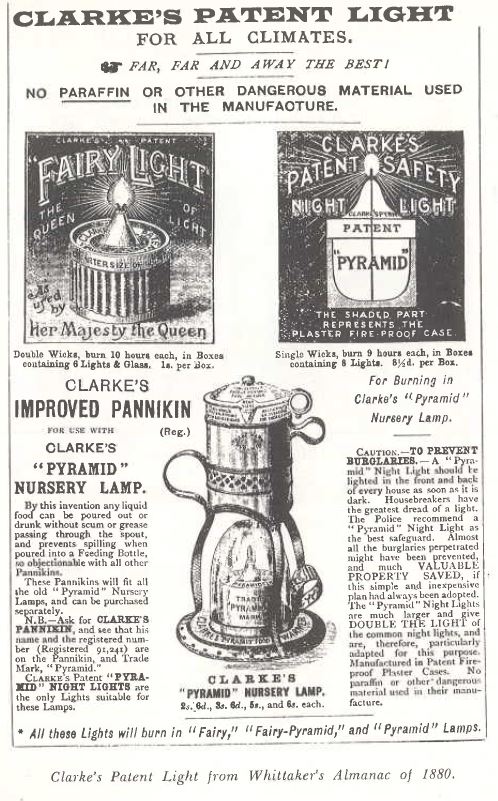
The image size is (498, 801). What are the coordinates of `lid of nursery lamp` in the screenshot? It's located at (251, 377).